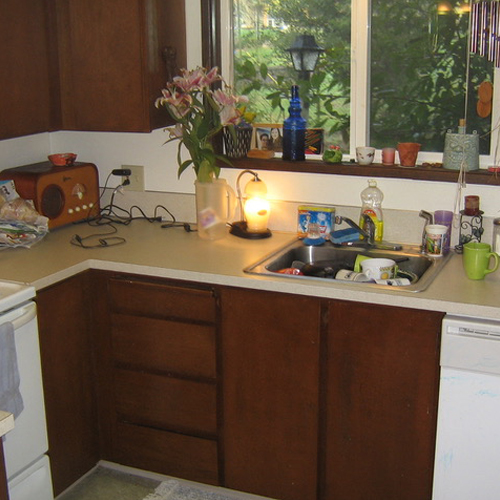
Image resolution: width=500 pixels, height=500 pixels. Identify the location of warming drawer under oven. (42, 493).